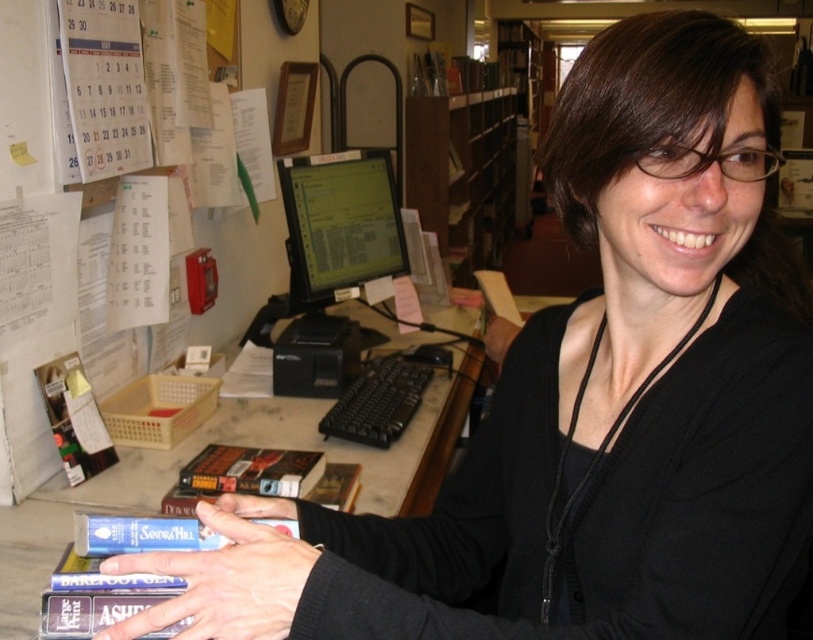
This screenshot has height=640, width=813. Describe the element at coordinates (377, 401) in the screenshot. I see `black plastic keyboard at center` at that location.

Between black plastic keyboard at center and matte black hand at center, which one has less height?

matte black hand at center

Is point (392, 353) farther from viewer compared to point (511, 340)?

Yes, point (392, 353) is behind point (511, 340).

Identify the location of black plastic keyboard at center. (377, 401).

You are a GUI agent. You are given a task and a screenshot of the screen. Output one action in this format:
    pyautogui.click(x=<x>, y=<y>)
    Task: Click on the marble desk at center
    This screenshot has width=813, height=640.
    Given the screenshot: What is the action you would take?
    pyautogui.click(x=231, y=444)

I want to click on marble desk at center, so click(x=231, y=444).

Can you confirm if clear plastic hand at center is wider than matte black hand at center?

Indeed, clear plastic hand at center has a greater width compared to matte black hand at center.

Does clear plastic hand at center appear under matte black hand at center?

Correct, clear plastic hand at center is located below matte black hand at center.

The image size is (813, 640). Describe the element at coordinates (222, 582) in the screenshot. I see `clear plastic hand at center` at that location.

At what (x,y) coordinates should I click in order to perform the action: click on clear plastic hand at center. Please return your answer as a coordinate pair (x, y). The image size is (813, 640). Looking at the image, I should click on (222, 582).